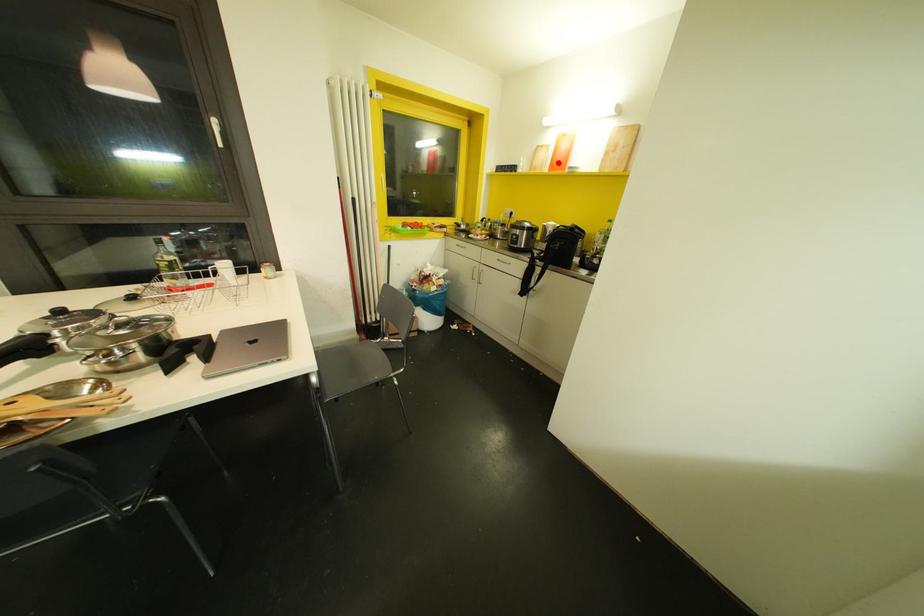
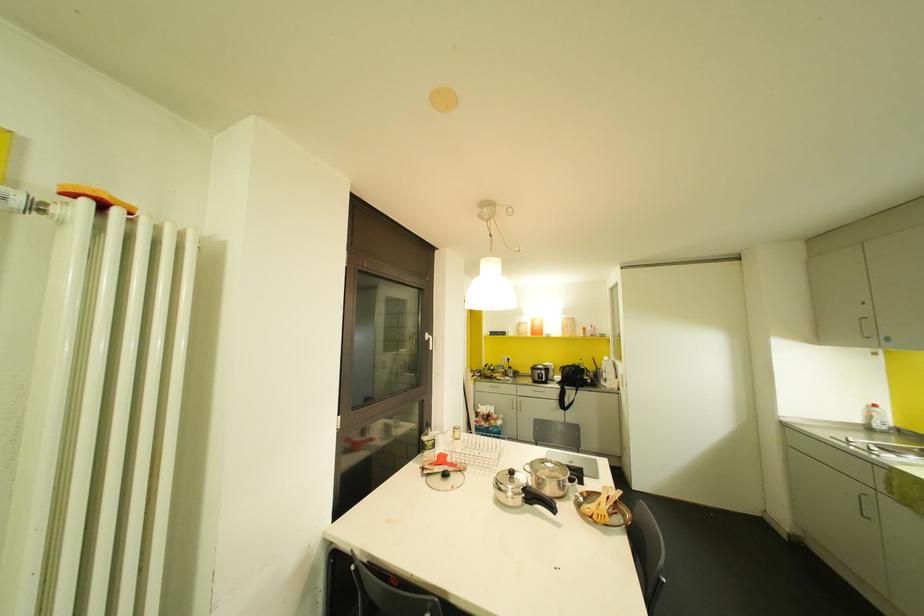
Where in the second image is the point corresponding to the highlighted location from the first image?

(536, 331)